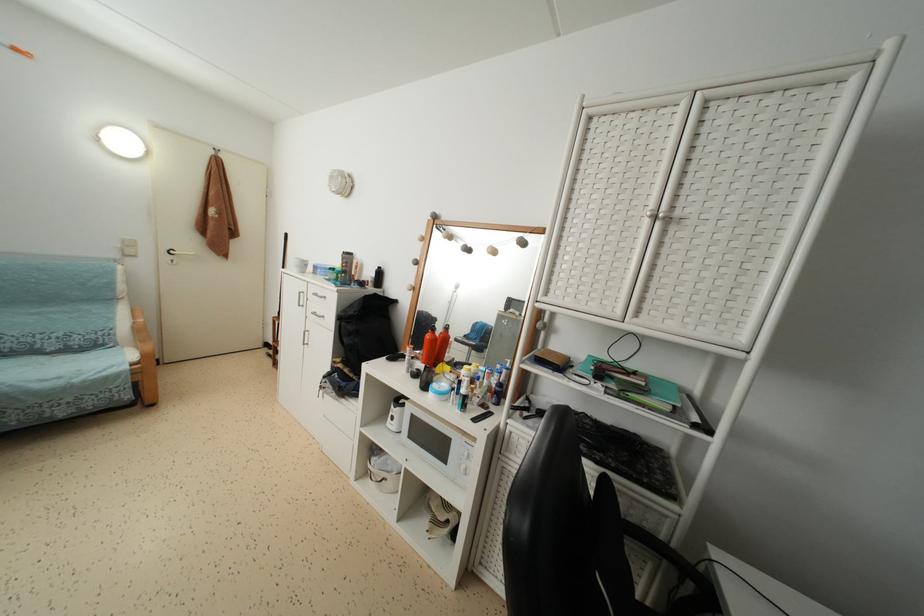
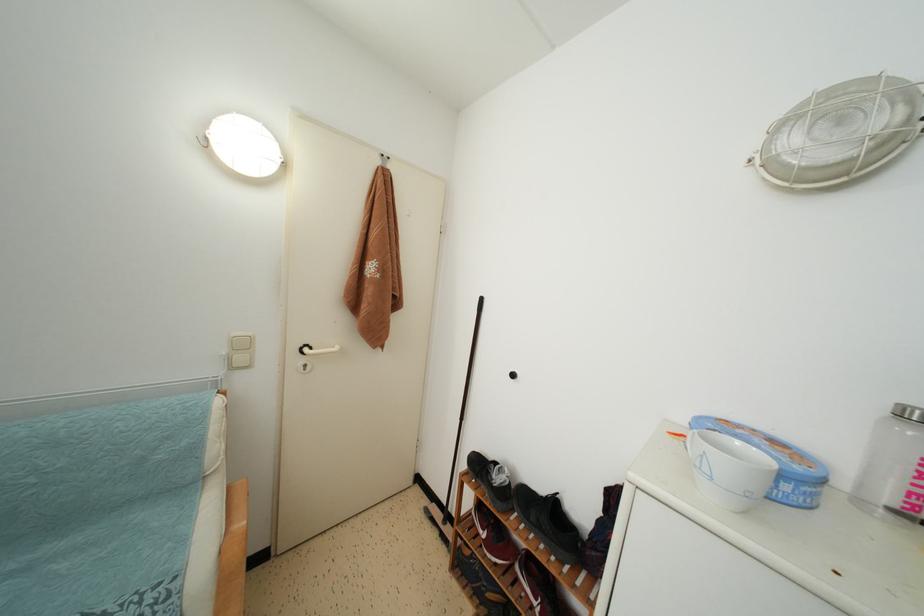
In a continuous first-person perspective shot, in which direction is the camera moving?

The cameraman moved toward left, forward.